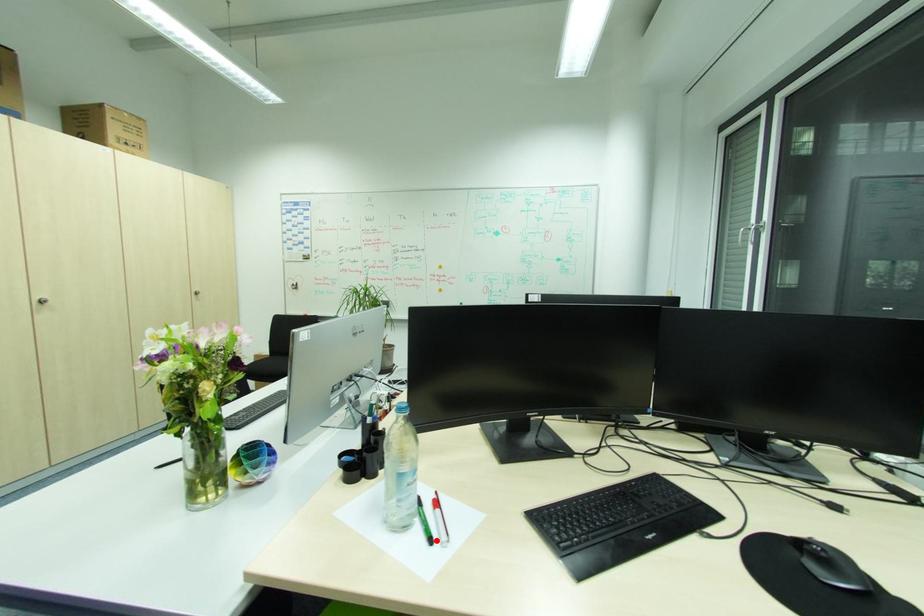
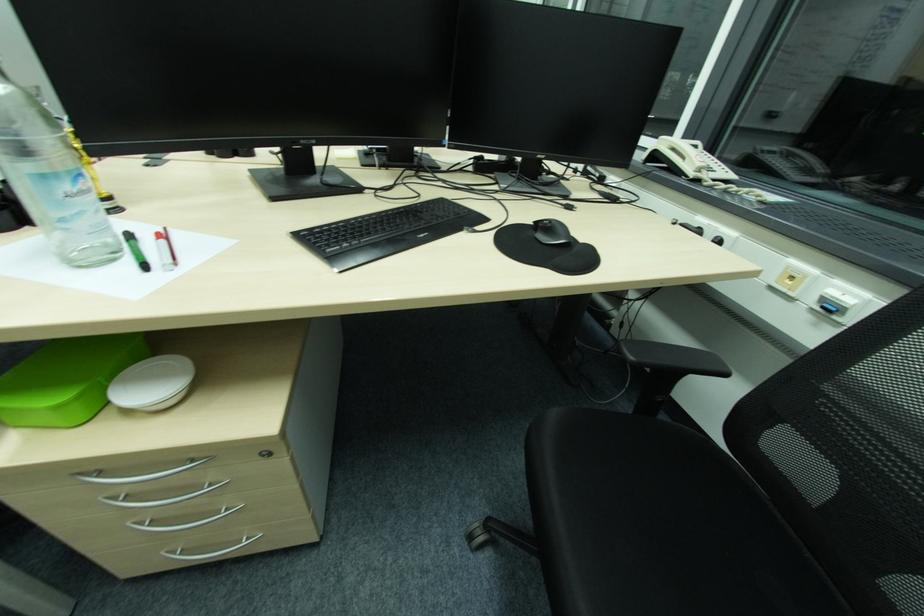
In the second image, find the point that corresponds to the highlighted location in the first image.

(149, 267)